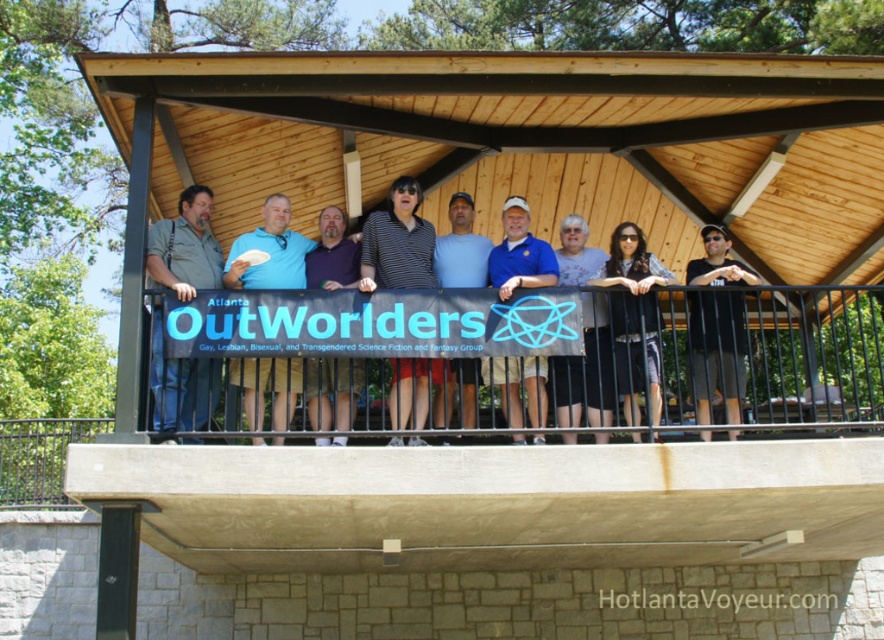
You are organizing a photo shoot and need to ensure that the striped polo shirt at center and the blue cotton polo shirt at center are both visible in the frame. Given their sizes, which shirt should you position closer to the camera to ensure both are clearly visible?

The striped polo shirt at center occupies less space than the blue cotton polo shirt at center, so you should position the striped polo shirt at center closer to the camera to ensure both are clearly visible.